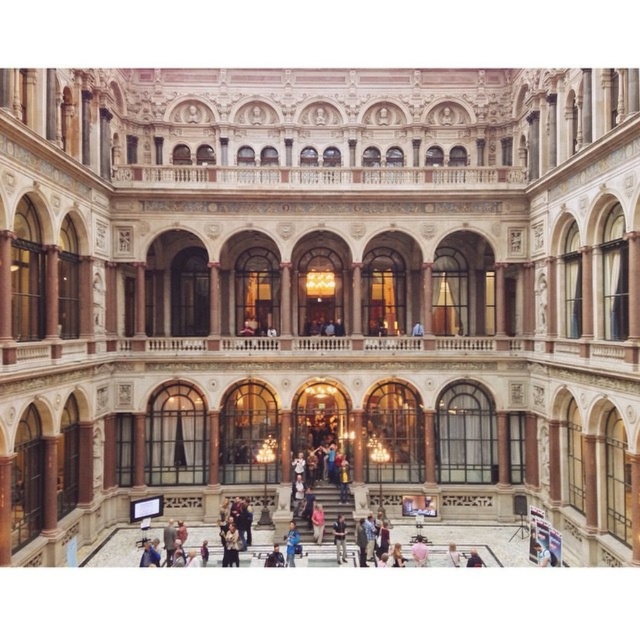
You are standing in the courtyard and see a dark blue shirt at center and a light brown leather jacket at lower center. Which object is positioned to the right when viewed from your perspective?

The dark blue shirt at center is positioned to the right of the light brown leather jacket at lower center.

You are a guest at this grand building and want to place your brown fur coat at lower center on a hanger next to your dark blue shirt at center. Considering their sizes, will the hanger have enough space for both items?

Result: The brown fur coat at lower center has a lesser width compared to dark blue shirt at center. Therefore, the hanger may have enough space for both items, but the total width of both items combined needs to be considered against the hanger and its placement.

You are a guest entering the courtyard and need to choose between the brown fur coat at lower center and the light brown leather jacket at lower center. Which one is shorter?

The brown fur coat at lower center is shorter than the light brown leather jacket at lower center.